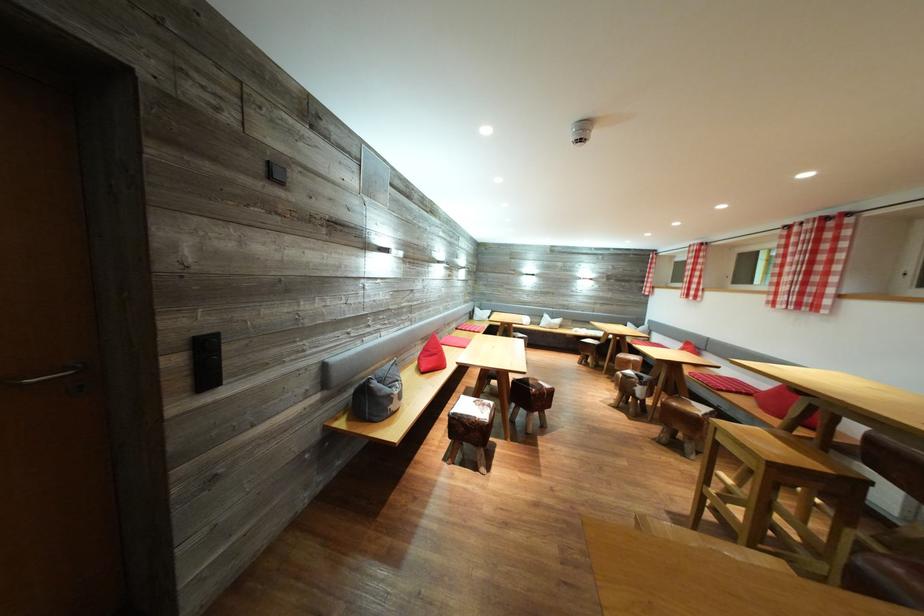
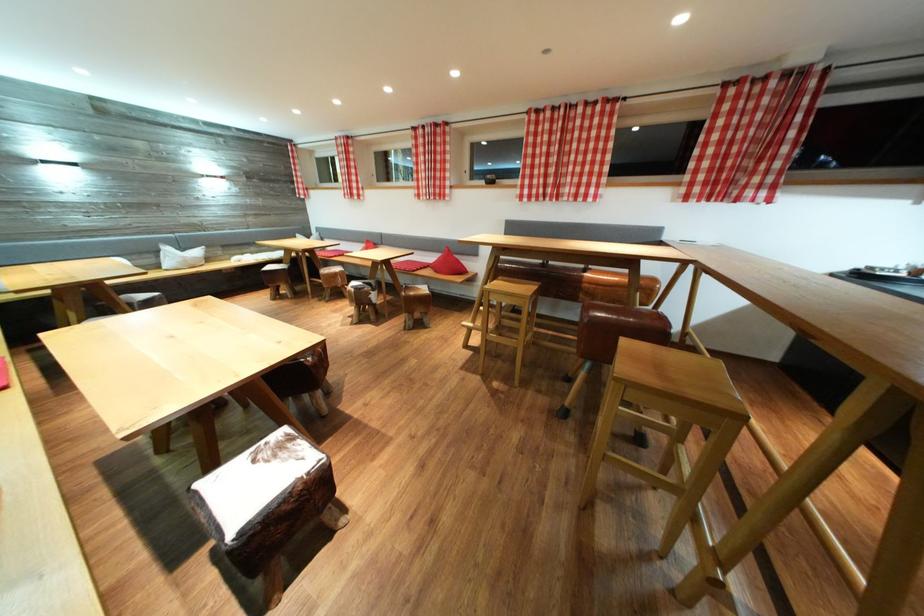
Locate, in the second image, the point that corresponds to [490,410] in the first image.

(286, 452)